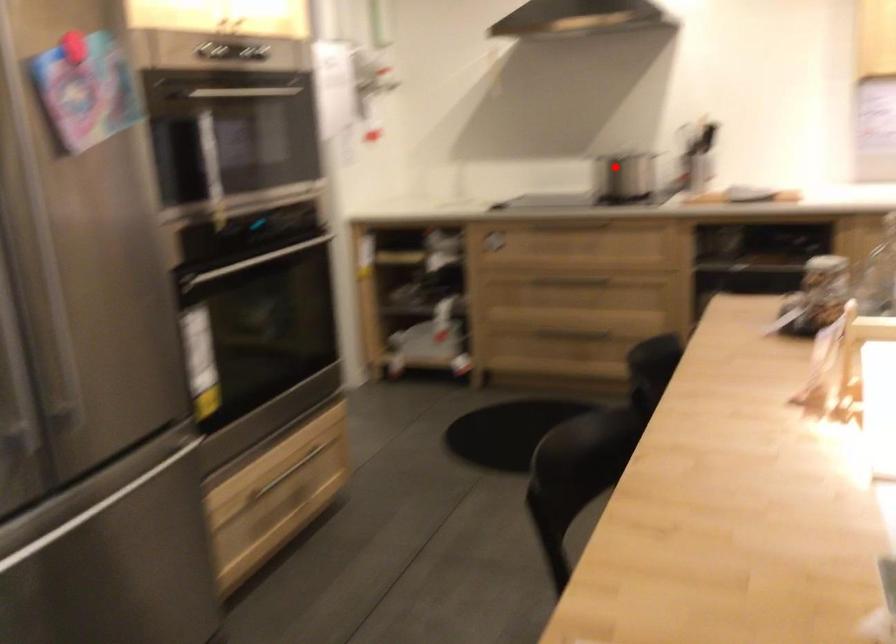
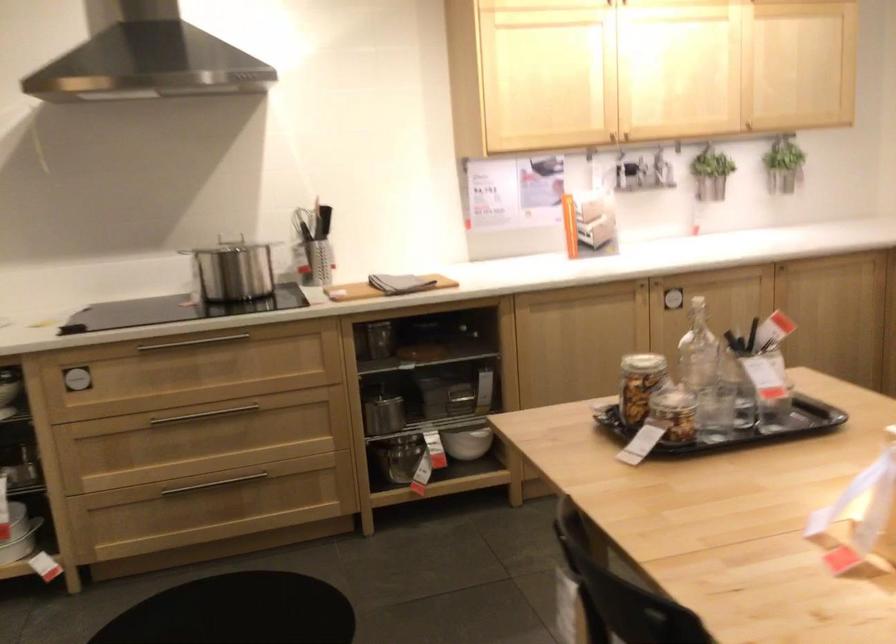
Where in the second image is the point corresponding to the highlighted location from the first image?

(231, 274)